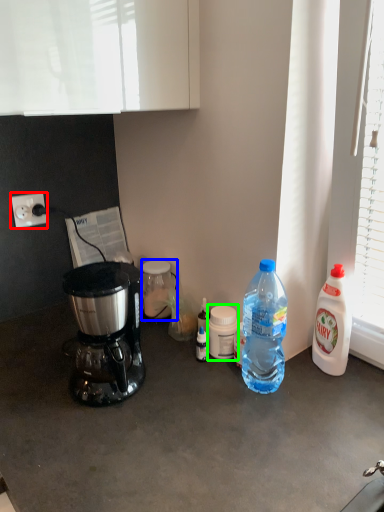
Question: Which object is the closest to the power outlet (highlighted by a red box)? Choose among these: bottle (highlighted by a blue box) or bottle (highlighted by a green box).

Choices:
 (A) bottle
 (B) bottle

Answer: (A)